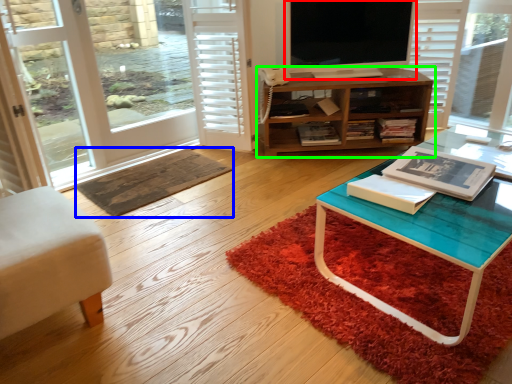
Question: Which object is positioned farthest from television (highlighted by a red box)? Select from doormat (highlighted by a blue box) and cabinetry (highlighted by a green box).

Choices:
 (A) doormat
 (B) cabinetry

Answer: (A)